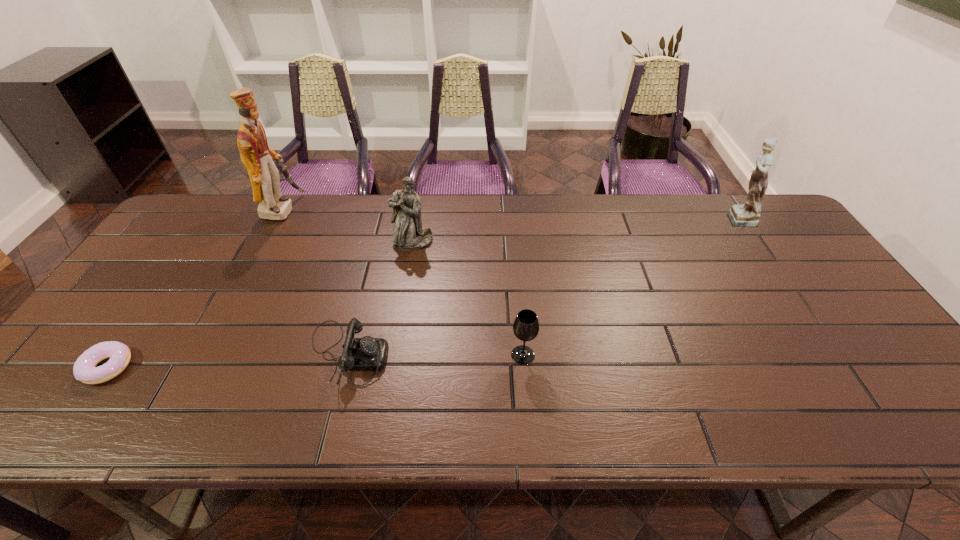
Find the location of a particular element. object that is at the left edge is located at coordinates (84, 369).

This screenshot has height=540, width=960. I want to click on object that is at the right edge, so click(746, 215).

You are a GUI agent. You are given a task and a screenshot of the screen. Output one action in this format:
    pyautogui.click(x=<x>, y=<y>)
    Task: Click on the object at the far right corner
    This screenshot has height=540, width=960.
    Given the screenshot: What is the action you would take?
    pyautogui.click(x=746, y=215)

In the image, there is a desktop. What are the coordinates of `vacant space at the far edge` in the screenshot? It's located at (520, 199).

This screenshot has height=540, width=960. I want to click on blank area at the near edge, so click(x=453, y=416).

You are a GUI agent. You are given a task and a screenshot of the screen. Output one action in this format:
    pyautogui.click(x=<x>, y=<y>)
    Task: Click on the free space at the left edge
    Image resolution: width=960 pixels, height=540 pixels.
    Given the screenshot: What is the action you would take?
    [x=180, y=288]

You are a GUI agent. You are given a task and a screenshot of the screen. Output one action in this format:
    pyautogui.click(x=<x>, y=<y>)
    Task: Click on the vacant region at the right edge of the desktop
    The image size is (960, 540).
    Given the screenshot: What is the action you would take?
    pyautogui.click(x=852, y=367)

In the image, there is a desktop. Identify the location of free space at the far right corner. The height and width of the screenshot is (540, 960). (779, 223).

Where is `free space at the near right corner of the desktop`? The width and height of the screenshot is (960, 540). free space at the near right corner of the desktop is located at coordinates (915, 427).

At what (x,y) coordinates should I click in order to perform the action: click on empty space that is in between the rightmost object and the second object from left to right. Please return your answer as a coordinate pair (x, y). Looking at the image, I should click on (509, 214).